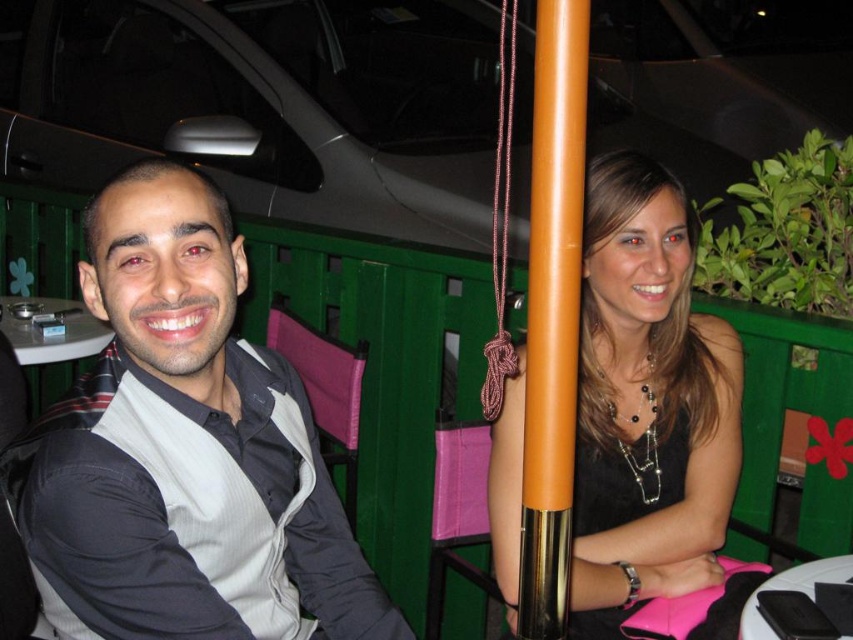
Between point (595, 532) and point (527, 451), which one is positioned behind?

Point (595, 532)

Is black satin dress at center taller than orange glossy pole at center?

Indeed, black satin dress at center has a greater height compared to orange glossy pole at center.

The image size is (853, 640). I want to click on black satin dress at center, so click(646, 403).

Does black satin dress at center appear on the left side of white glossy table at lower right?

Indeed, black satin dress at center is positioned on the left side of white glossy table at lower right.

Does black satin dress at center appear under white glossy table at lower right?

No.

You are a GUI agent. You are given a task and a screenshot of the screen. Output one action in this format:
    pyautogui.click(x=<x>, y=<y>)
    Task: Click on the black satin dress at center
    
    Given the screenshot: What is the action you would take?
    pyautogui.click(x=646, y=403)

In order to click on black satin dress at center in this screenshot , I will do `click(646, 403)`.

Which is below, gray fabric shirt at left or white glossy table at lower left?

gray fabric shirt at left is below.

Can you confirm if gray fabric shirt at left is wider than white glossy table at lower left?

Yes, gray fabric shirt at left is wider than white glossy table at lower left.

Is point (287, 458) farther from viewer compared to point (54, 356)?

That is False.

Identify the location of gray fabric shirt at left. (183, 451).